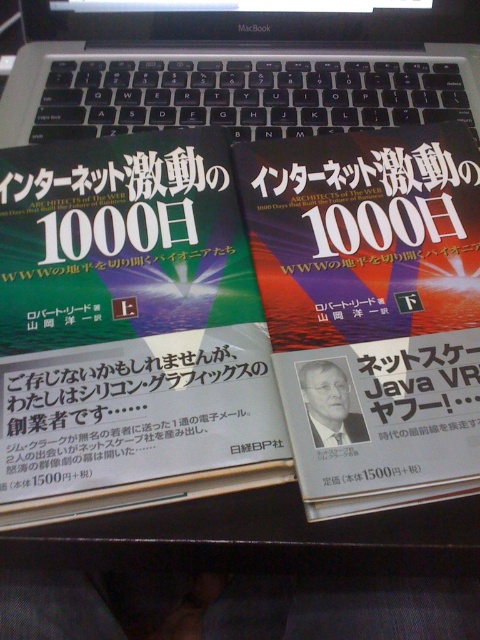
You are organizing your desk and want to place a new notebook between the matte paper book at center and the black plastic keyboard at upper center. Can you fit it there?

The matte paper book at center is to the right of the black plastic keyboard at upper center, so there is space between them where the notebook can be placed.